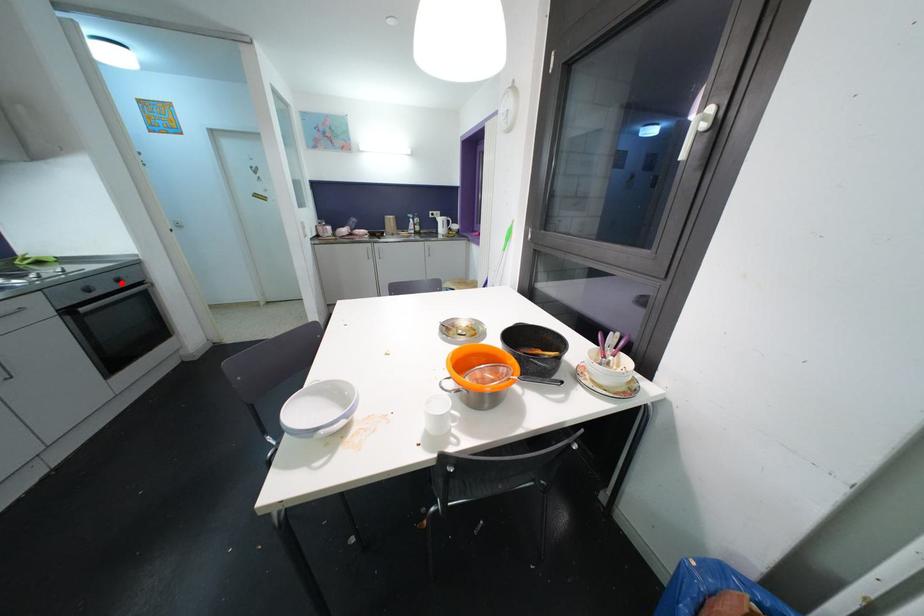
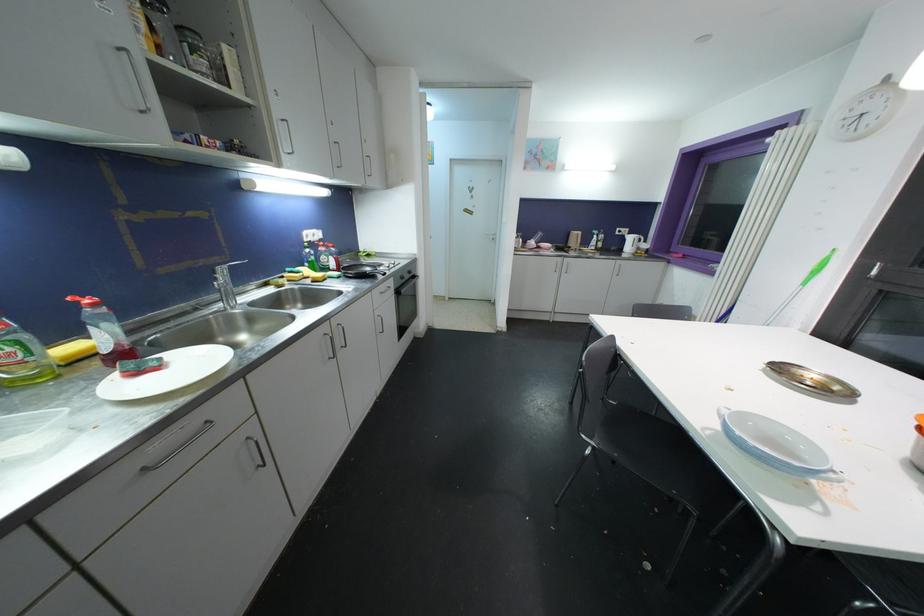
Find the pixel in the second image that matches the highlighted location in the first image.

(412, 275)